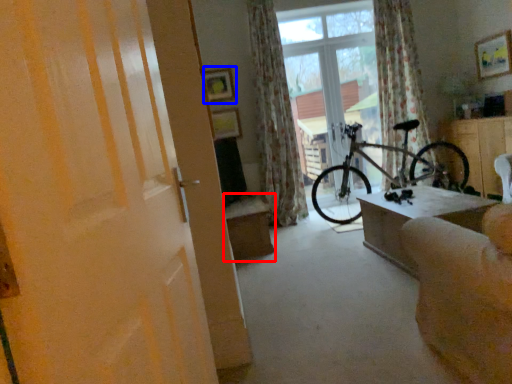
Question: Which object is further to the camera taking this photo, table (highlighted by a red box) or picture frame (highlighted by a blue box)?

Choices:
 (A) table
 (B) picture frame

Answer: (B)